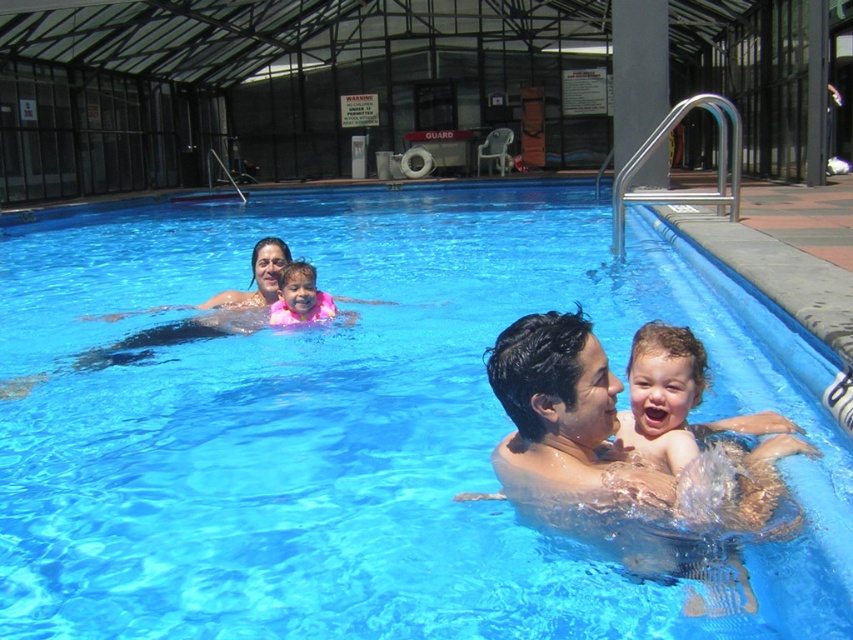
Question: Is transparent blue water at center smaller than light brown skin at center?

Choices:
 (A) yes
 (B) no

Answer: (B)

Question: Which is nearer to the transparent blue water at center?

Choices:
 (A) shiny wet hair at center
 (B) pink fabric at center

Answer: (B)

Question: Which point appears farthest from the camera in this image?

Choices:
 (A) (270, 305)
 (B) (654, 328)
 (C) (399, 476)
 (D) (595, 481)

Answer: (A)

Question: Does transparent blue water at center have a lesser width compared to shiny wet hair at center?

Choices:
 (A) yes
 (B) no

Answer: (B)

Question: From the image, what is the correct spatial relationship of shiny wet hair at center in relation to light brown skin at center?

Choices:
 (A) left
 (B) right

Answer: (A)

Question: Which point is closer to the camera?

Choices:
 (A) (532, 474)
 (B) (318, 296)
 (C) (670, 388)
 (D) (781, 611)

Answer: (D)